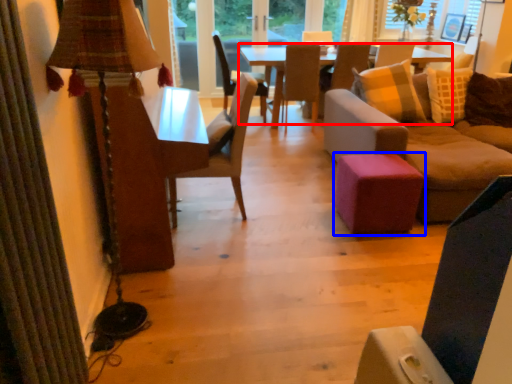
Question: Which object appears farthest to the camera in this image, table (highlighted by a red box) or stool (highlighted by a blue box)?

Choices:
 (A) table
 (B) stool

Answer: (A)